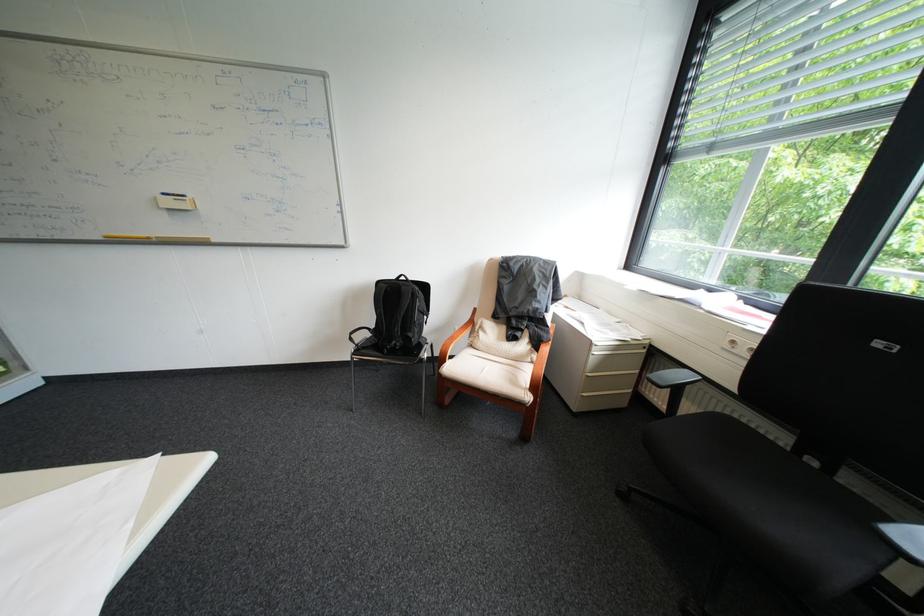
You are a GUI agent. You are given a task and a screenshot of the screen. Output one action in this format:
    pyautogui.click(x=<x>, y=<y>)
    Task: Click on the drawer handle
    
    Given the screenshot: What is the action you would take?
    pyautogui.click(x=616, y=349)